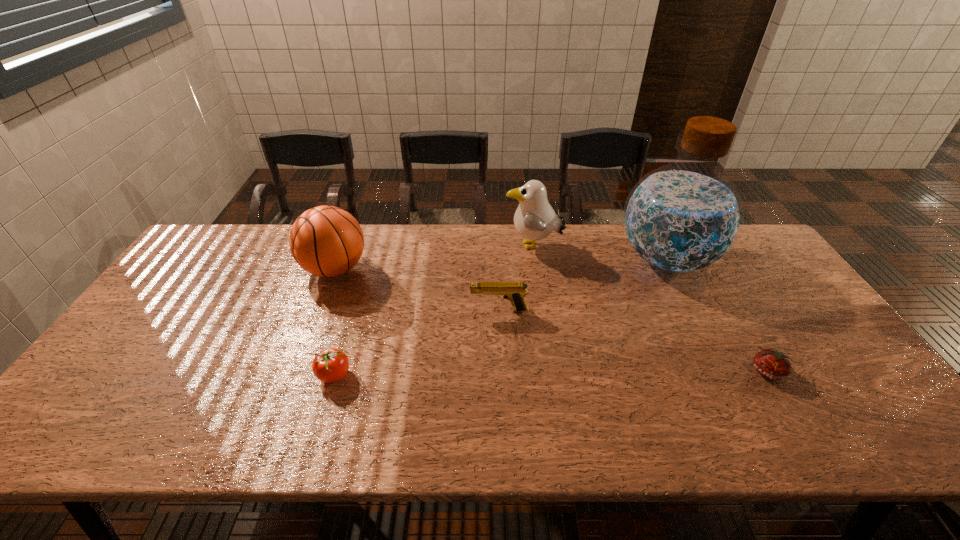
The image size is (960, 540). What are the coordinates of `free space that satisfies the following two spatial constraints: 1. on the beak of the gull; 2. on the right side of the tallest object` in the screenshot? It's located at (535, 259).

At what (x,y) coordinates should I click in order to perform the action: click on vacant space that satisfies the following two spatial constraints: 1. on the back side of the shortest object; 2. on the left side of the left tomato. Please return your answer as a coordinate pair (x, y). This screenshot has height=540, width=960. Looking at the image, I should click on (334, 372).

Find the location of `blank area in the image that satisfies the following two spatial constraints: 1. on the beak of the gull; 2. on the left side of the tallest object`. blank area in the image that satisfies the following two spatial constraints: 1. on the beak of the gull; 2. on the left side of the tallest object is located at coordinates (535, 259).

Where is `vacant area in the image that satisfies the following two spatial constraints: 1. on the beak of the water jug; 2. on the right side of the gull`? vacant area in the image that satisfies the following two spatial constraints: 1. on the beak of the water jug; 2. on the right side of the gull is located at coordinates (535, 259).

Identify the location of free space that satisfies the following two spatial constraints: 1. on the beak of the water jug; 2. on the left side of the gull. The width and height of the screenshot is (960, 540). (535, 259).

The image size is (960, 540). Find the location of `free space that satisfies the following two spatial constraints: 1. on the beak of the shortest object; 2. on the right side of the gull`. free space that satisfies the following two spatial constraints: 1. on the beak of the shortest object; 2. on the right side of the gull is located at coordinates (552, 372).